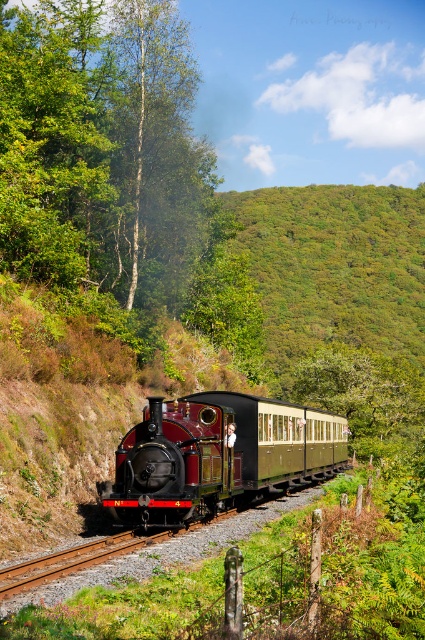
From the picture: You are a hiker carrying a backpack and want to cross between the smooth bark tree at center and the green leafy tree at left. The path between them is narrow. If your backpack is 1.8 meters wide, can you pass through without removing it?

The distance between the smooth bark tree at center and the green leafy tree at left is 2.00 meters. Since your backpack is 1.8 meters wide, there is enough space to pass through without removing it.

You are a passenger on the polished brass train at center and want to see the green leafy tree at left outside your window. Can you see the entire tree from your current position?

The polished brass train at center is behind the green leafy tree at left, so the tree is in front of the train. Since you are on the train, you can see the green leafy tree at left but not its entire height because the train is positioned behind it, possibly blocking part of the view.

You are standing at the point marked by point (x=102, y=148) in the image. Looking around, you see a smooth bark tree at center. Which direction should you walk to reach the vintage steam locomotive traveling through the landscape?

The point (x=102, y=148) marks the smooth bark tree at center, so you are already at the tree. To reach the vintage steam locomotive, you should walk towards the direction where the train is traveling along the railway track, which is likely away from the tree towards the path of the locomotive.